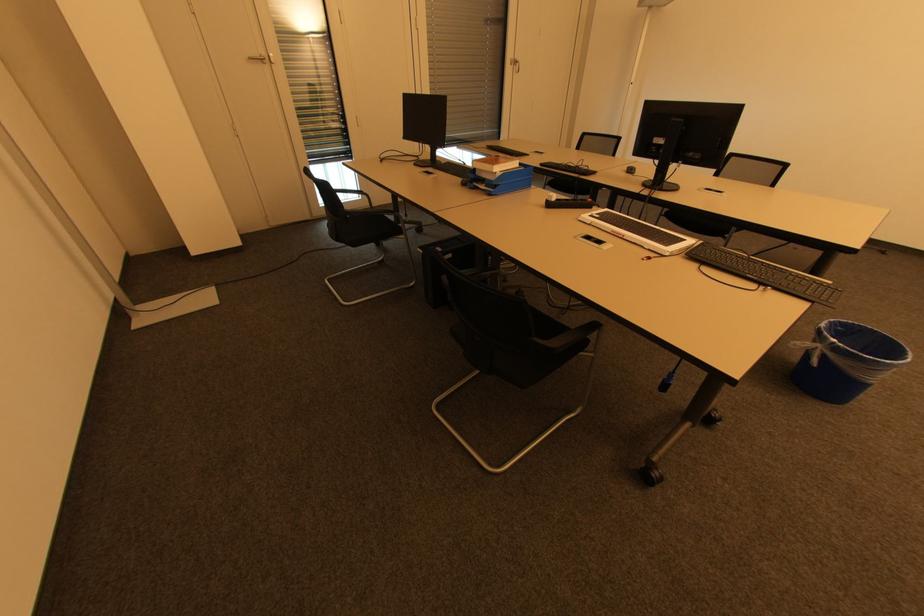
Find the location of a particular element. This screenshot has width=924, height=616. silver door handle is located at coordinates (257, 57).